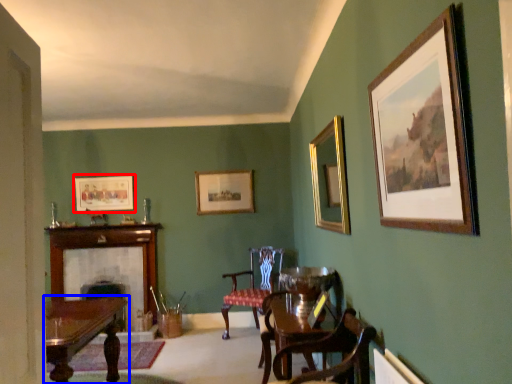
Question: Among these objects, which one is nearest to the camera, picture frame (highlighted by a red box) or table (highlighted by a blue box)?

Choices:
 (A) picture frame
 (B) table

Answer: (B)